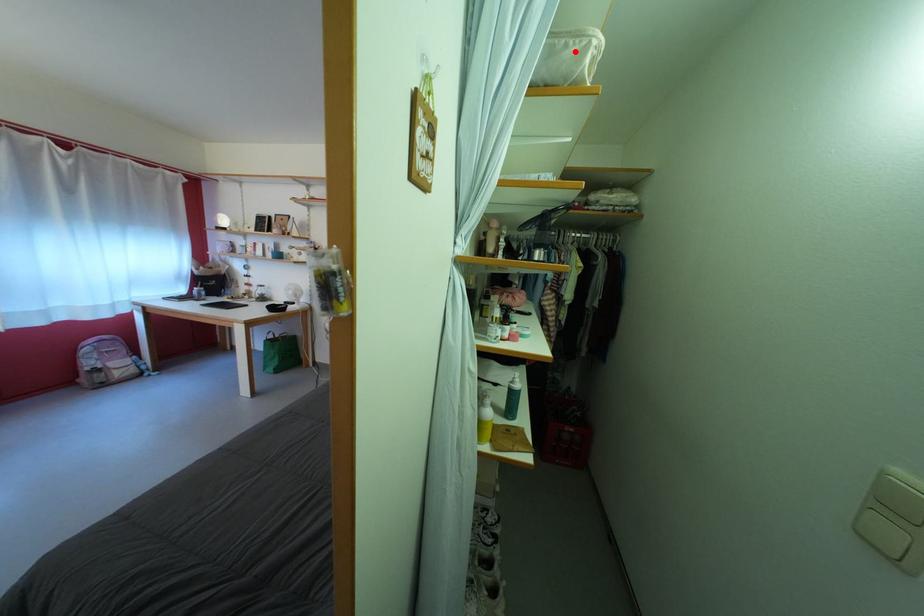
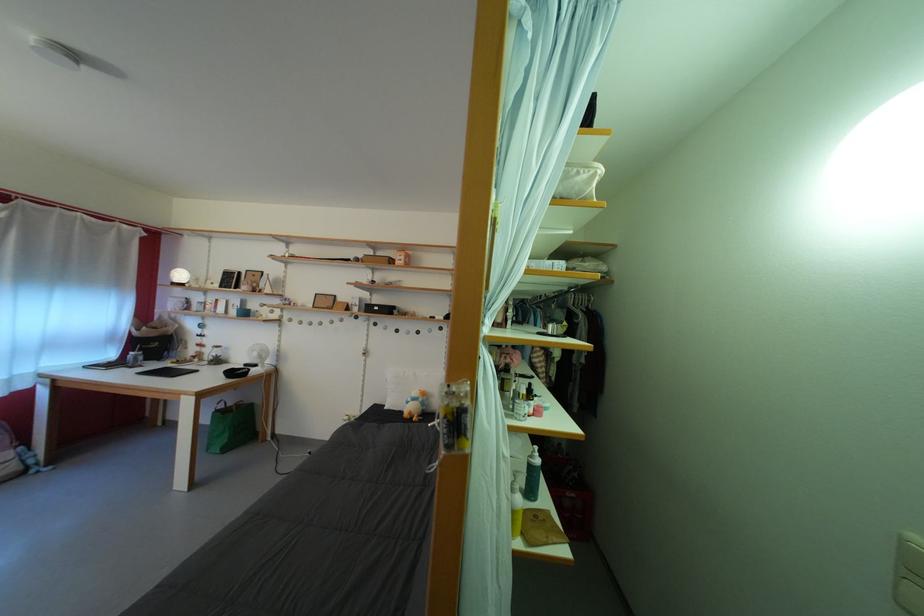
Where in the second image is the point corresponding to the highlighted location from the first image?

(587, 179)